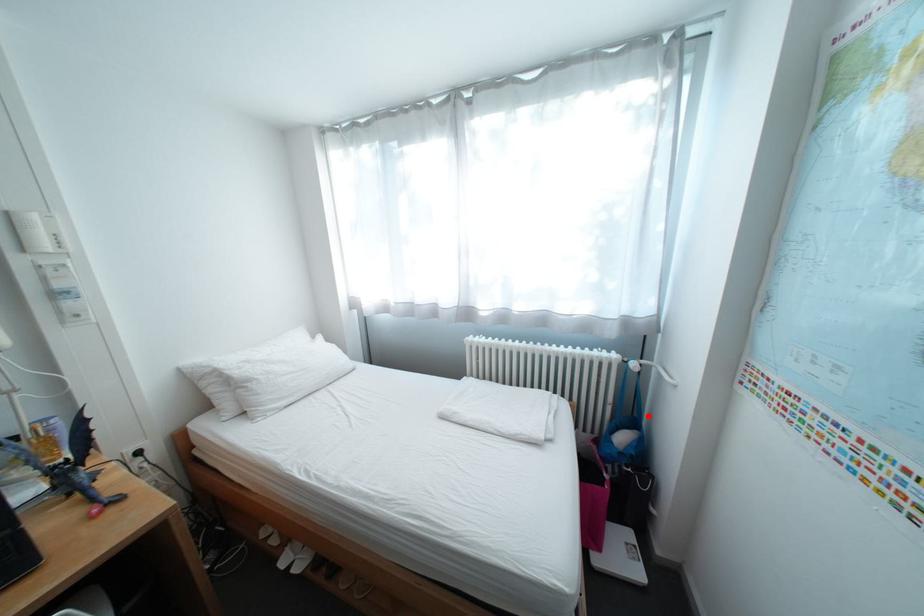
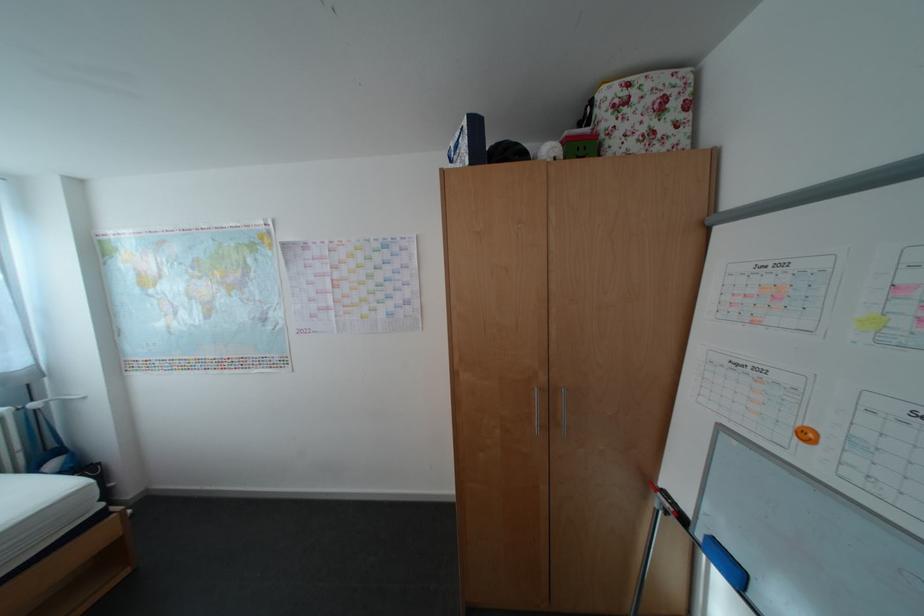
The point at the highlighted location is marked in the first image. Where is the corresponding point in the second image?

(67, 447)